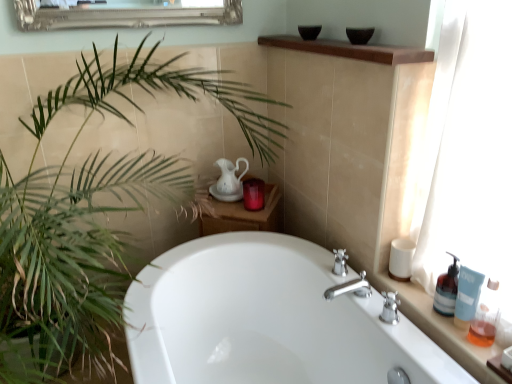
Find the location of `vacant area that is in front of white matte cup at right, positioned as the second toiletry in bottom-to-top order`. vacant area that is in front of white matte cup at right, positioned as the second toiletry in bottom-to-top order is located at coordinates (416, 300).